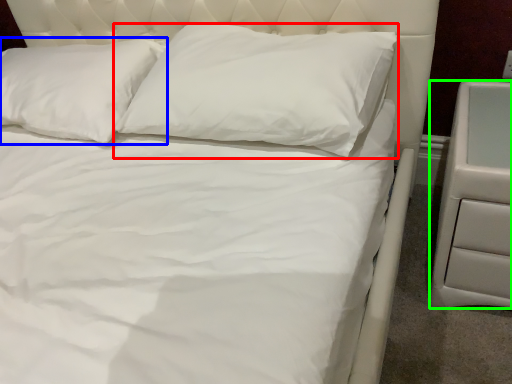
Question: Estimate the real-world distances between objects in this image. Which object is farther from pillow (highlighted by a red box), pillow (highlighted by a blue box) or nightstand (highlighted by a green box)?

Choices:
 (A) pillow
 (B) nightstand

Answer: (B)